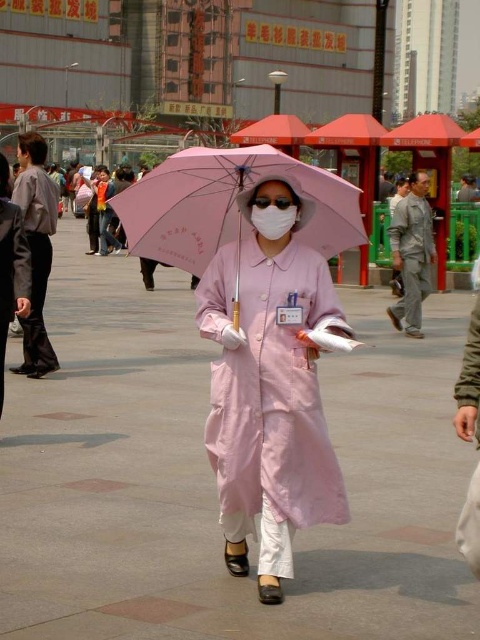
Question: Among these objects, which one is farthest from the camera?

Choices:
 (A) white matte mask at center
 (B) matte black robe at left

Answer: (B)

Question: Does matte pink coat at center have a larger size compared to pink fabric umbrella at center?

Choices:
 (A) yes
 (B) no

Answer: (A)

Question: Does gray cotton robe at right have a smaller size compared to matte black robe at left?

Choices:
 (A) no
 (B) yes

Answer: (A)

Question: Is pink fabric umbrella at center to the right of matte black robe at left from the viewer's perspective?

Choices:
 (A) no
 (B) yes

Answer: (B)

Question: Which point is farther from the camera taking this photo?

Choices:
 (A) (1, 282)
 (B) (417, 193)
 (C) (31, 333)

Answer: (B)

Question: Which object is closer to the camera taking this photo?

Choices:
 (A) matte gray robe at left
 (B) white matte mask at center

Answer: (B)